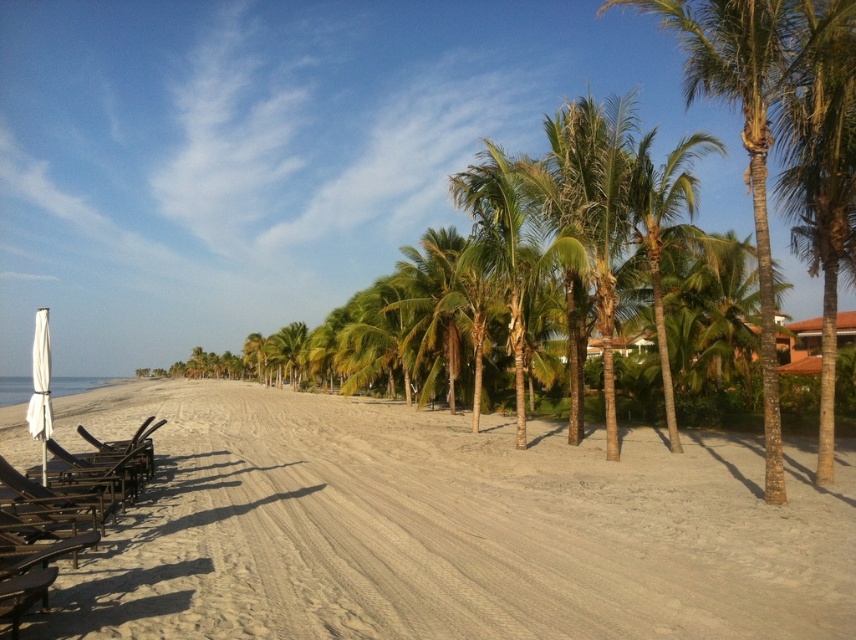
From the picture: You are standing at the origin point of the coordinate system in this beach scene. You want to walk to the beige sandy beach at center. Which direction should you move in?

The beige sandy beach at center is located at coordinate point 0.827 on the x axis and 0.521 on the y axis. Since you are at the origin point, you should move towards the positive x and positive y directions to reach it.

You are planning to set up a small tent for a beach picnic. The beige sandy beach at center and the metallic black beach chair at left are both visible in your view. Which area would be more suitable for placing the tent, and why?

The beige sandy beach at center is more suitable for placing the tent because it is larger in size than the metallic black beach chair at left, providing enough space for the tent.